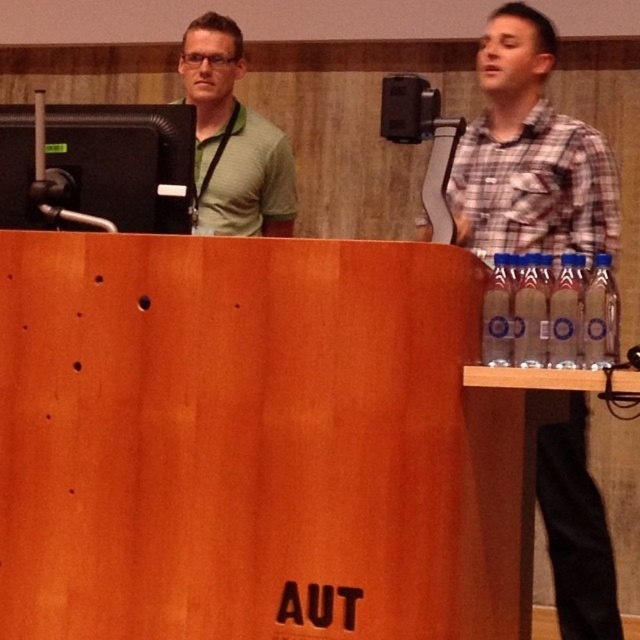
Question: Which point is farther from the camera taking this photo?

Choices:
 (A) (524, 180)
 (B) (410, 90)

Answer: (A)

Question: Which of the following is the closest to the observer?

Choices:
 (A) (196, 108)
 (B) (412, 80)

Answer: (B)

Question: Observing the image, what is the correct spatial positioning of green matte shirt at upper left in reference to metallic speaker at upper center?

Choices:
 (A) left
 (B) right

Answer: (A)

Question: Is green matte shirt at upper left bigger than metallic speaker at upper center?

Choices:
 (A) yes
 (B) no

Answer: (A)

Question: Does clear plastic bottles at right have a larger size compared to metallic speaker at upper center?

Choices:
 (A) no
 (B) yes

Answer: (B)

Question: Which point appears farthest from the camera in this image?

Choices:
 (A) (404, 90)
 (B) (241, 132)
 (C) (588, 241)

Answer: (B)